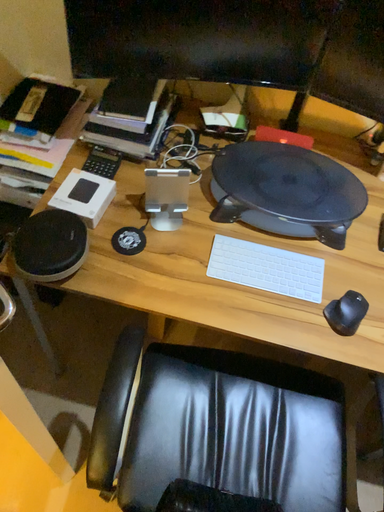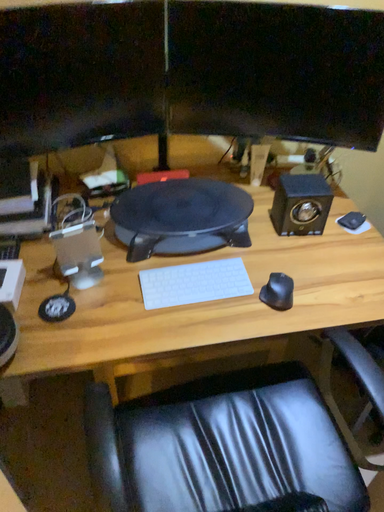
Question: Which way did the camera rotate in the video?

Choices:
 (A) rotated upward
 (B) rotated downward

Answer: (A)